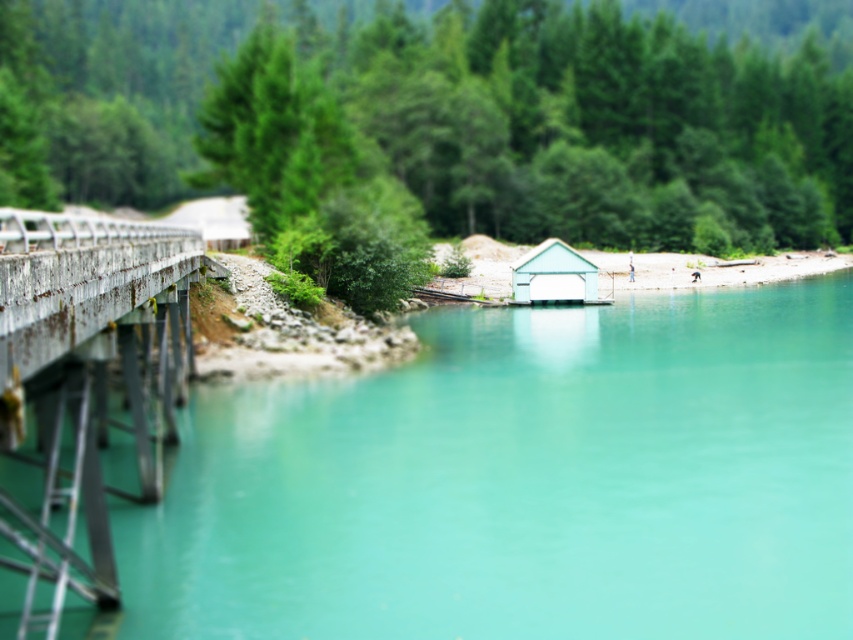
Question: Is rusty metal bridge at left smaller than light blue matte hut at center?

Choices:
 (A) yes
 (B) no

Answer: (B)

Question: Which object is positioned farthest from the light blue matte hut at center?

Choices:
 (A) rusty metal bridge at left
 (B) teal glossy water at center

Answer: (A)

Question: Which point is farther to the camera?

Choices:
 (A) light blue matte hut at center
 (B) rusty metal bridge at left

Answer: (A)

Question: Is teal glossy water at center thinner than light blue matte hut at center?

Choices:
 (A) no
 (B) yes

Answer: (A)

Question: Does teal glossy water at center appear under light blue matte hut at center?

Choices:
 (A) no
 (B) yes

Answer: (B)

Question: Which of the following is the farthest from the observer?

Choices:
 (A) (683, 438)
 (B) (91, 227)
 (C) (577, 260)

Answer: (C)